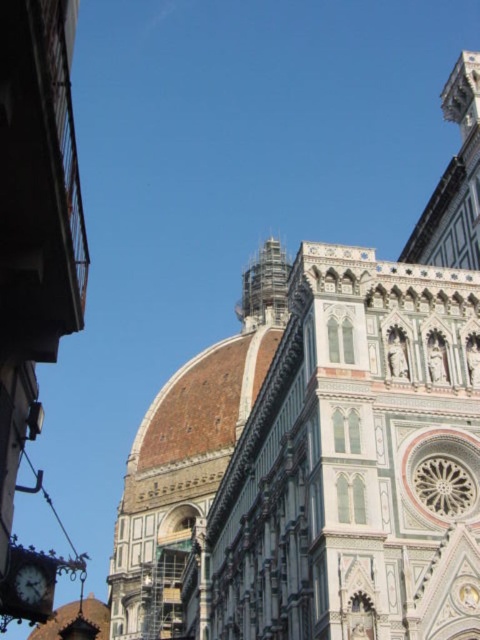
Question: Does brown tiled dome at center have a larger size compared to matte black clock at lower left?

Choices:
 (A) yes
 (B) no

Answer: (A)

Question: Among these points, which one is nearest to the camera?

Choices:
 (A) (213, 497)
 (B) (33, 586)

Answer: (B)

Question: In this image, where is brown tiled dome at center located relative to matte black clock at lower left?

Choices:
 (A) below
 (B) above

Answer: (B)

Question: Does brown tiled dome at center lie behind matte black clock at lower left?

Choices:
 (A) no
 (B) yes

Answer: (B)